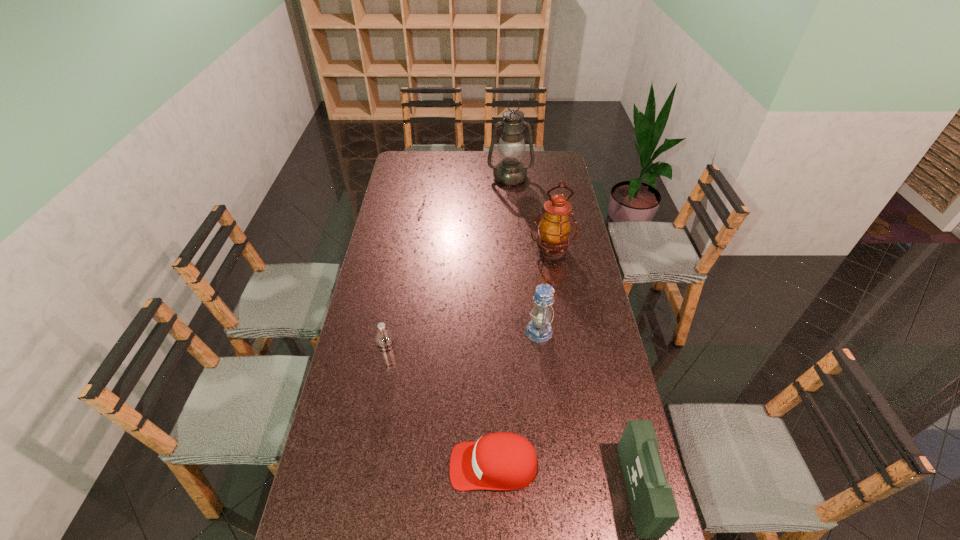
Find the location of a particular element. The image size is (960, 540). vacant area that lies between the third nearest object and the fifth shortest object is located at coordinates (470, 306).

You are a GUI agent. You are given a task and a screenshot of the screen. Output one action in this format:
    pyautogui.click(x=<x>, y=<y>)
    Task: Click on the vacant space that is in between the tallest object and the leftmost object
    
    Given the screenshot: What is the action you would take?
    pyautogui.click(x=450, y=270)

Locate an element on the screen. The width and height of the screenshot is (960, 540). blank region between the leftmost object and the lantern is located at coordinates [x=465, y=347].

Where is `free spot between the baseball cap and the leftmost object`? free spot between the baseball cap and the leftmost object is located at coordinates (442, 414).

The height and width of the screenshot is (540, 960). In order to click on empty location between the baseball cap and the shorter oil lamp in this screenshot , I will do click(522, 357).

Where is `free space between the fifth shortest object and the first-aid kit`? free space between the fifth shortest object and the first-aid kit is located at coordinates (594, 370).

Where is `free space between the first-aid kit and the farthest object`? Image resolution: width=960 pixels, height=540 pixels. free space between the first-aid kit and the farthest object is located at coordinates (573, 333).

Find the location of a particular element. The image size is (960, 540). vacant region between the first-aid kit and the shortest object is located at coordinates (565, 477).

At what (x,y) coordinates should I click in order to perform the action: click on free spot between the second farthest object and the farther oil lamp. Please return your answer as a coordinate pair (x, y). The image size is (960, 540). Looking at the image, I should click on (531, 213).

This screenshot has height=540, width=960. I want to click on vacant space that is in between the farthest object and the baseball cap, so click(x=502, y=321).